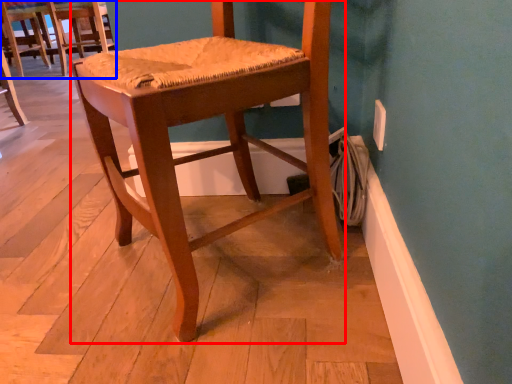
Question: Which of the following is the farthest to the observer, chair (highlighted by a red box) or chair (highlighted by a blue box)?

Choices:
 (A) chair
 (B) chair

Answer: (B)